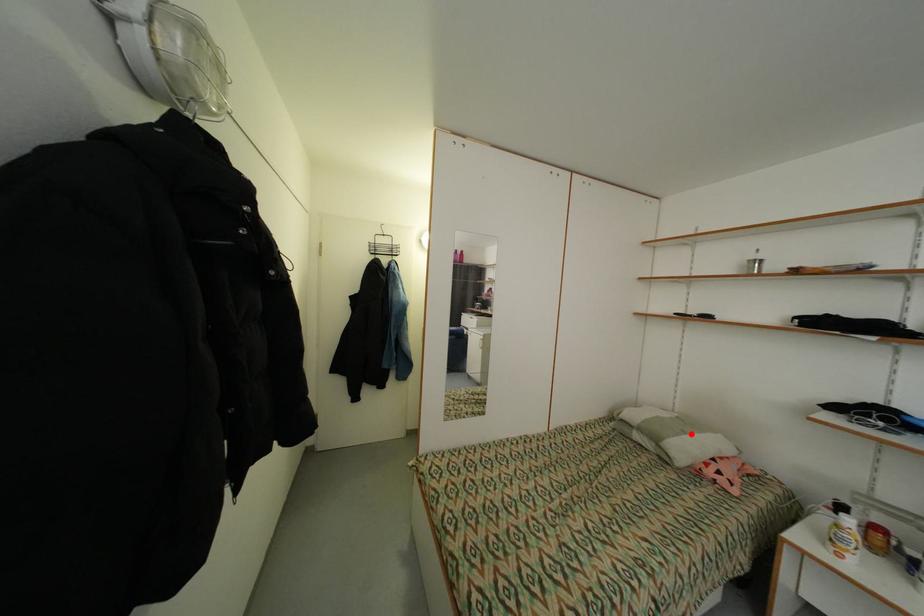
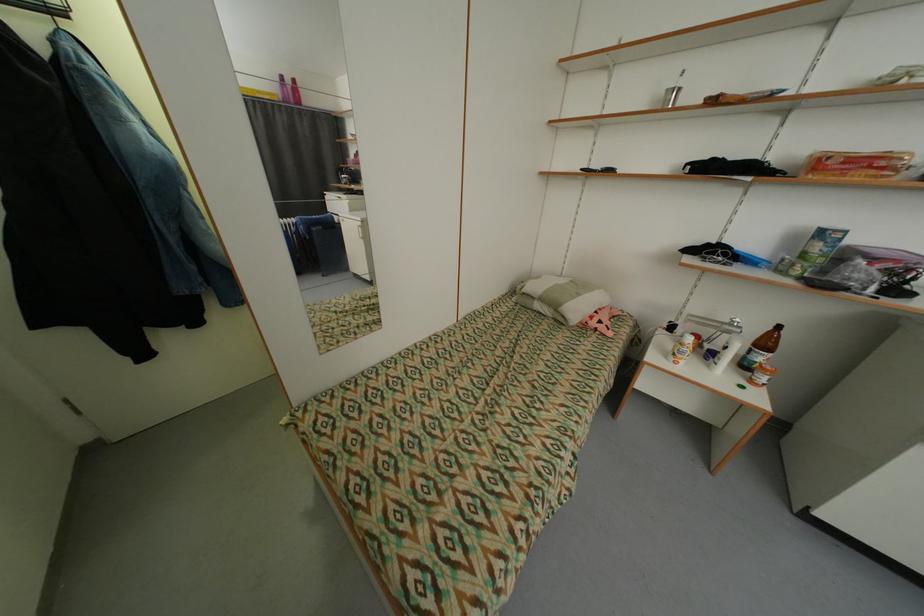
Question: I am providing you with two images of the same scene from different viewpoints. A red point is marked on the first image. Can you still see the location of the red point in image 2?

Choices:
 (A) Yes
 (B) No

Answer: (A)